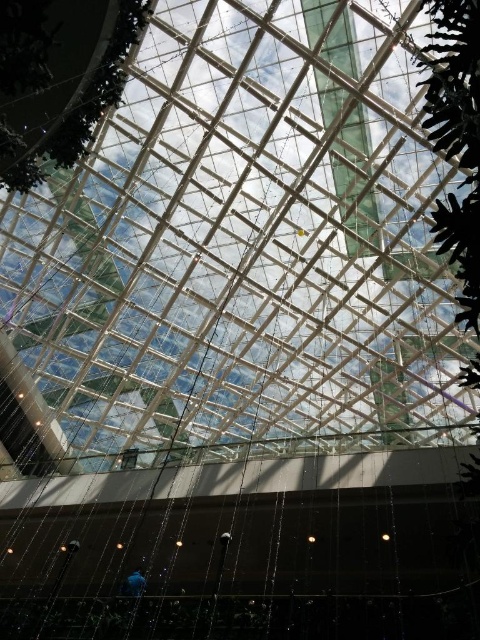
Question: Is green leafy tree at upper center to the left of green leafy tree at upper right from the viewer's perspective?

Choices:
 (A) yes
 (B) no

Answer: (A)

Question: Which of the following is the farthest from the observer?

Choices:
 (A) (434, 19)
 (B) (259, 131)

Answer: (B)

Question: Which is farther from the green leafy tree at upper right?

Choices:
 (A) transparent glass roof at center
 (B) green leafy tree at upper center

Answer: (A)

Question: Does transparent glass roof at center appear on the right side of green leafy tree at upper right?

Choices:
 (A) no
 (B) yes

Answer: (A)

Question: Does transparent glass roof at center appear over green leafy tree at upper right?

Choices:
 (A) yes
 (B) no

Answer: (B)

Question: Which point is closer to the camera?

Choices:
 (A) transparent glass roof at center
 (B) green leafy tree at upper center
 (C) green leafy tree at upper right

Answer: (C)